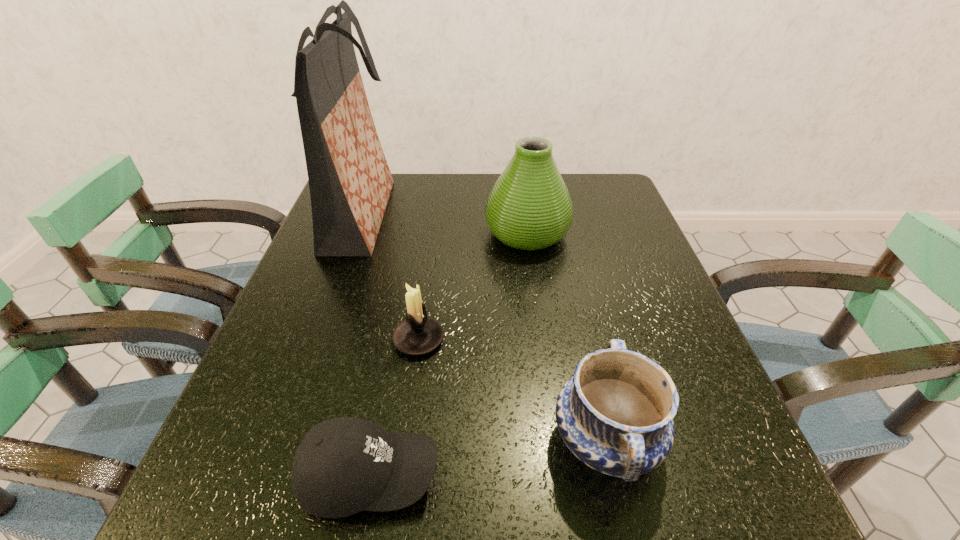
I want to click on vacant space at the far edge, so click(466, 192).

Find the location of `free location at the near edge`. free location at the near edge is located at coordinates (615, 502).

Locate an element on the screen. vacant area at the left edge is located at coordinates (313, 281).

The width and height of the screenshot is (960, 540). Identify the location of vacant space at the right edge of the desktop. (686, 374).

At what (x,y) coordinates should I click in order to perform the action: click on vacant area that lies between the fourth shortest object and the pottery. Please return your answer as a coordinate pair (x, y). Looking at the image, I should click on (566, 336).

Identify the location of free spot between the pottery and the vase. The height and width of the screenshot is (540, 960). (566, 336).

The width and height of the screenshot is (960, 540). Find the location of `unoccupied area between the shopping bag and the candle holder`. unoccupied area between the shopping bag and the candle holder is located at coordinates [391, 277].

Locate an element on the screen. The width and height of the screenshot is (960, 540). free space between the fourth shortest object and the third nearest object is located at coordinates (472, 286).

Find the location of `free space between the shopping bag and the baseball cap`. free space between the shopping bag and the baseball cap is located at coordinates (366, 346).

Where is `vacant area between the tallest object and the pottery`? The image size is (960, 540). vacant area between the tallest object and the pottery is located at coordinates (484, 327).